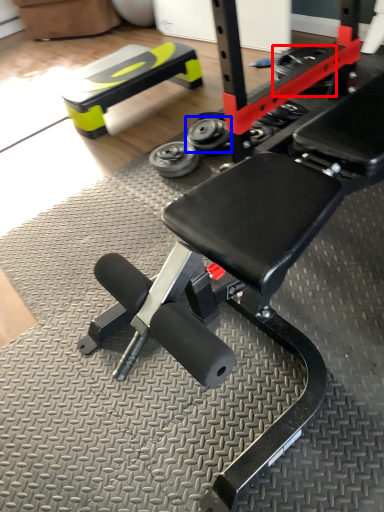
Question: Which point is further to the camera, tire (highlighted by a red box) or wheel (highlighted by a blue box)?

Choices:
 (A) tire
 (B) wheel

Answer: (A)